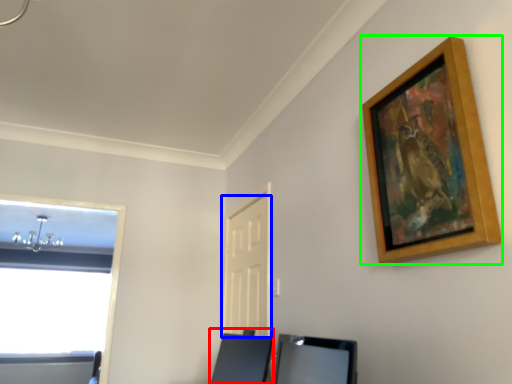
Question: Based on their relative distances, which object is farther from vanity (highlighted by a red box)? Choose from door (highlighted by a blue box) and picture frame (highlighted by a green box).

Choices:
 (A) door
 (B) picture frame

Answer: (B)